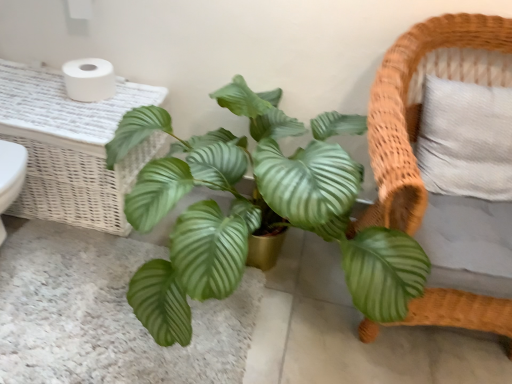
Locate an element on the screen. The height and width of the screenshot is (384, 512). free space in front of white matte toilet paper at upper left is located at coordinates coord(80,112).